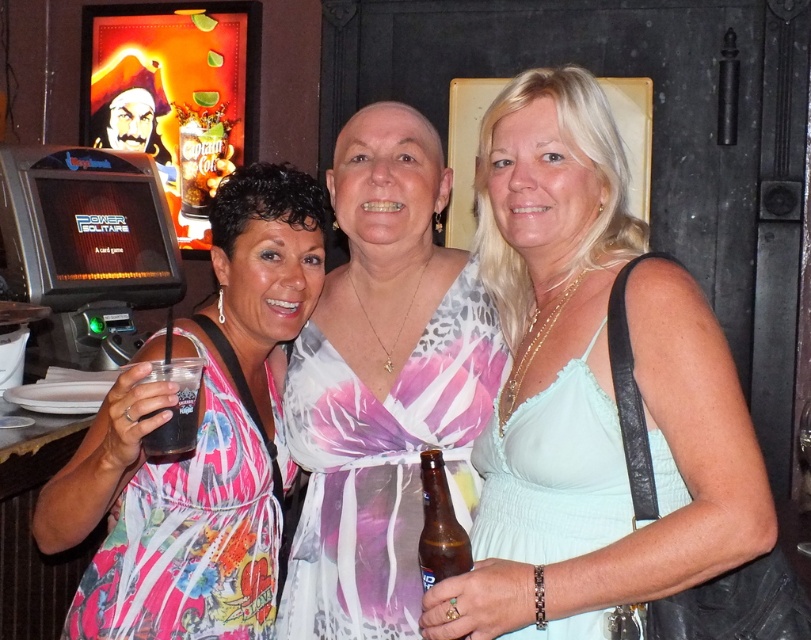
Question: Is floral dress at center positioned behind brown glass bottle at center?

Choices:
 (A) no
 (B) yes

Answer: (A)

Question: Which point appears farthest from the camera in this image?

Choices:
 (A) (191, 449)
 (B) (159, 81)
 (C) (586, 220)

Answer: (B)

Question: Which of these objects is positioned closest to the printed fabric dress at center?

Choices:
 (A) light blue fabric dress at center
 (B) brown glass bottle at center

Answer: (A)

Question: Is shiny pirate head at upper left closer to camera compared to brown glass bottle at center?

Choices:
 (A) no
 (B) yes

Answer: (A)

Question: Considering the relative positions of floral dress at center and translucent plastic cup at left in the image provided, where is floral dress at center located with respect to translucent plastic cup at left?

Choices:
 (A) below
 (B) above

Answer: (B)

Question: Which of these objects is positioned closest to the translucent plastic cup at left?

Choices:
 (A) shiny pirate head at upper left
 (B) floral dress at center

Answer: (B)